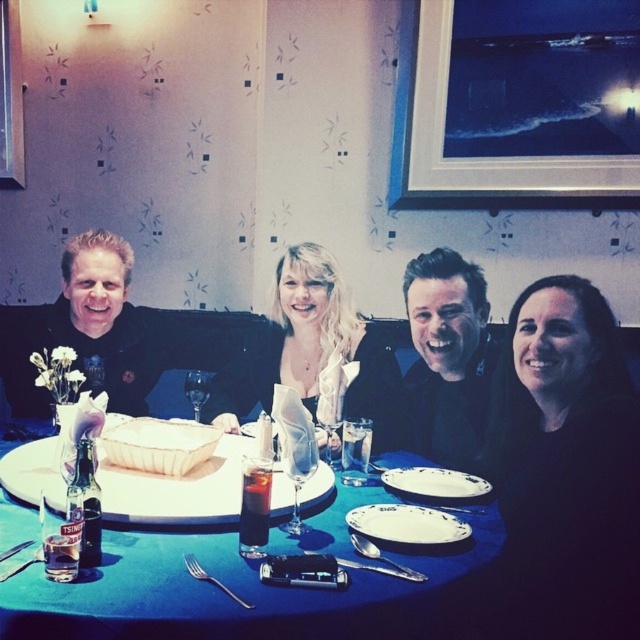
Which is more to the right, blonde hair at center or white ceramic plate at center?

Positioned to the right is white ceramic plate at center.

Locate an element on the screen. blonde hair at center is located at coordinates (310, 353).

This screenshot has width=640, height=640. Find the location of `blonde hair at center`. blonde hair at center is located at coordinates (310, 353).

Is point (179, 522) closer to viewer compared to point (417, 490)?

Yes, point (179, 522) is in front of point (417, 490).

Can you confirm if matte white platter at center is shorter than white ceramic plate at lower center?

No.

Which is in front, point (216, 509) or point (440, 497)?

Positioned in front is point (216, 509).

In order to click on matte white platter at center in this screenshot , I will do `click(177, 490)`.

In order to click on black glossy picture frame at upper right in this screenshot , I will do `click(516, 104)`.

Is black glossy picture frame at upper right positioned before matte black shirt at left?

That is False.

Does point (451, 124) come behind point (44, 403)?

Yes, point (451, 124) is behind point (44, 403).

Locate an element on the screen. black glossy picture frame at upper right is located at coordinates (516, 104).